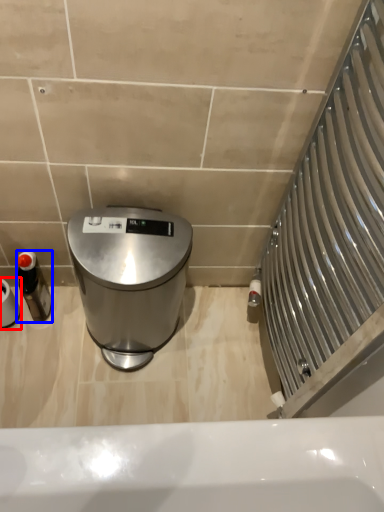
Question: Which object is closer to the camera taking this photo, toilet paper (highlighted by a red box) or bottle (highlighted by a blue box)?

Choices:
 (A) toilet paper
 (B) bottle

Answer: (A)